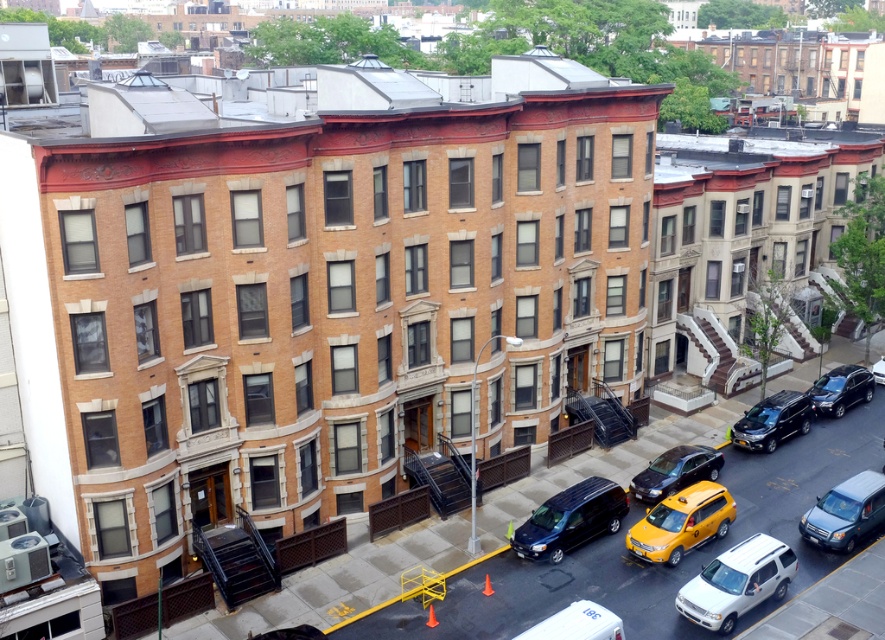
Can you confirm if shiny black van at center is positioned to the left of shiny black suv at lower right?

Indeed, shiny black van at center is positioned on the left side of shiny black suv at lower right.

Between shiny black van at center and shiny black suv at lower right, which one is positioned higher?

shiny black suv at lower right is above.

Which is behind, point (518, 525) or point (825, 401)?

The point (825, 401) is behind.

Locate an element on the screen. shiny black van at center is located at coordinates (571, 518).

What do you see at coordinates (571, 518) in the screenshot?
I see `shiny black van at center` at bounding box center [571, 518].

You are a GUI agent. You are given a task and a screenshot of the screen. Output one action in this format:
    pyautogui.click(x=<x>, y=<y>)
    Task: Click on the shiny black van at center
    
    Given the screenshot: What is the action you would take?
    click(571, 518)

Between white matte suv at center and shiny black suv at lower right, which one appears on the right side from the viewer's perspective?

Positioned to the right is shiny black suv at lower right.

Is white matte suv at center taller than shiny black suv at lower right?

Correct, white matte suv at center is much taller as shiny black suv at lower right.

Describe the element at coordinates (737, 582) in the screenshot. I see `white matte suv at center` at that location.

Locate an element on the screen. white matte suv at center is located at coordinates (737, 582).